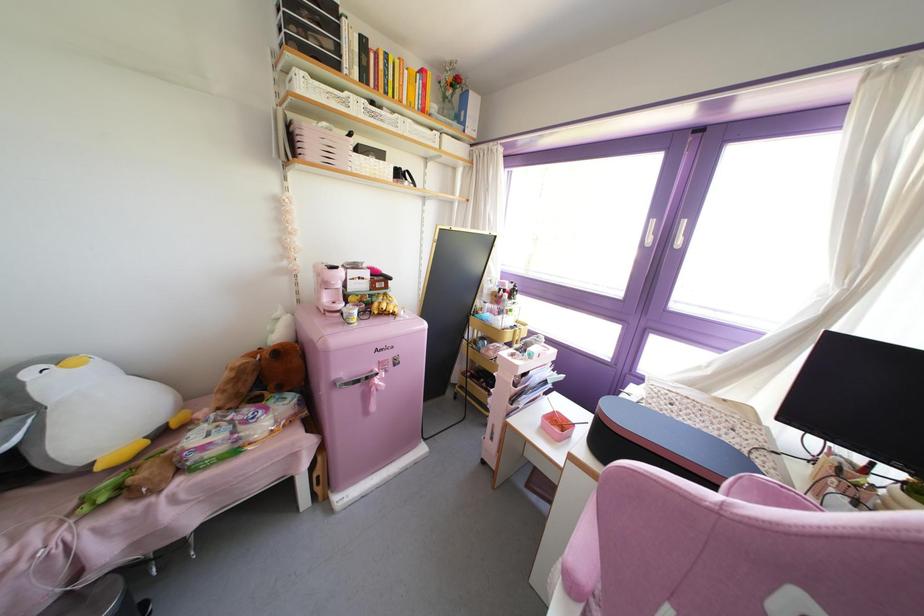
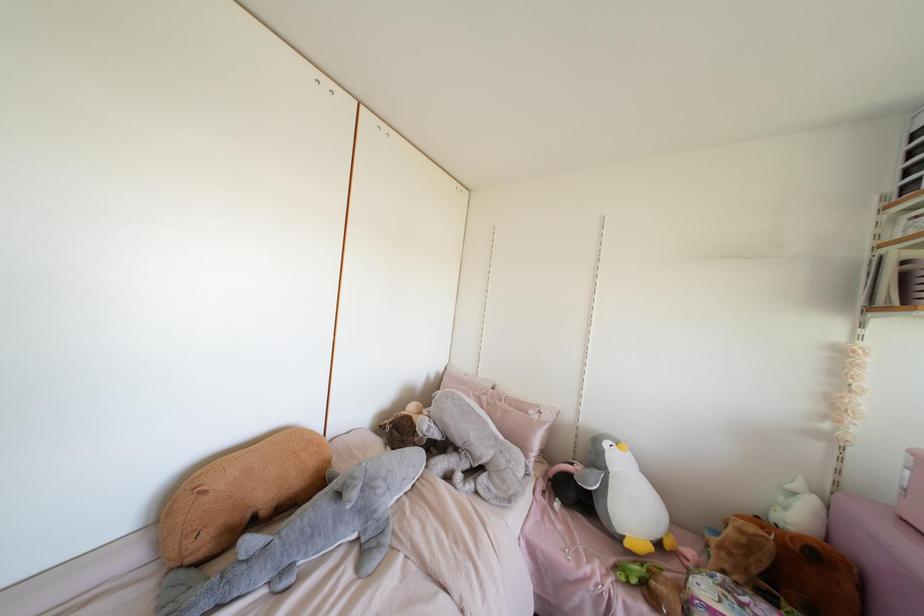
Find the pixel in the second image that matches point 99,467 in the first image.

(626, 544)